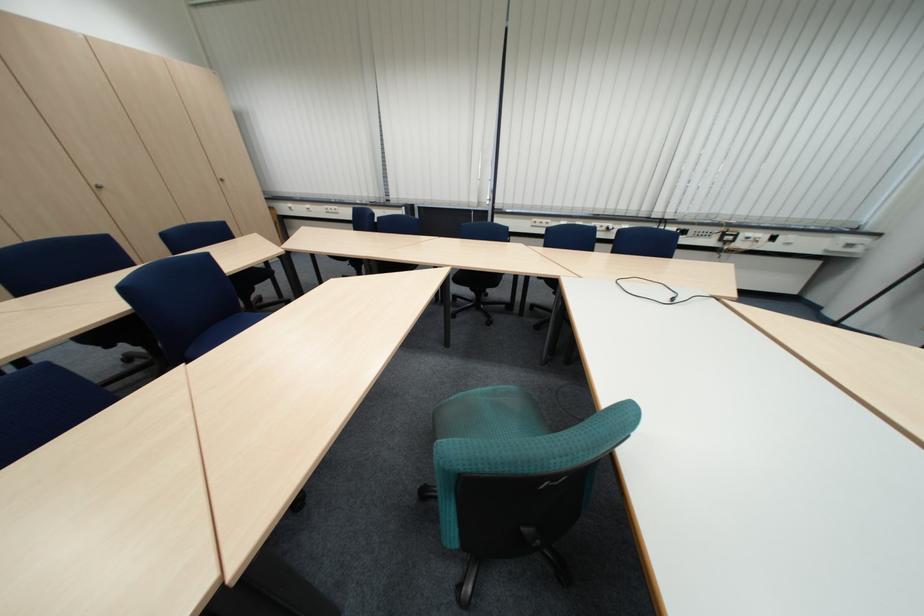
Find the location of a particular element. telephone handset is located at coordinates (755, 238).